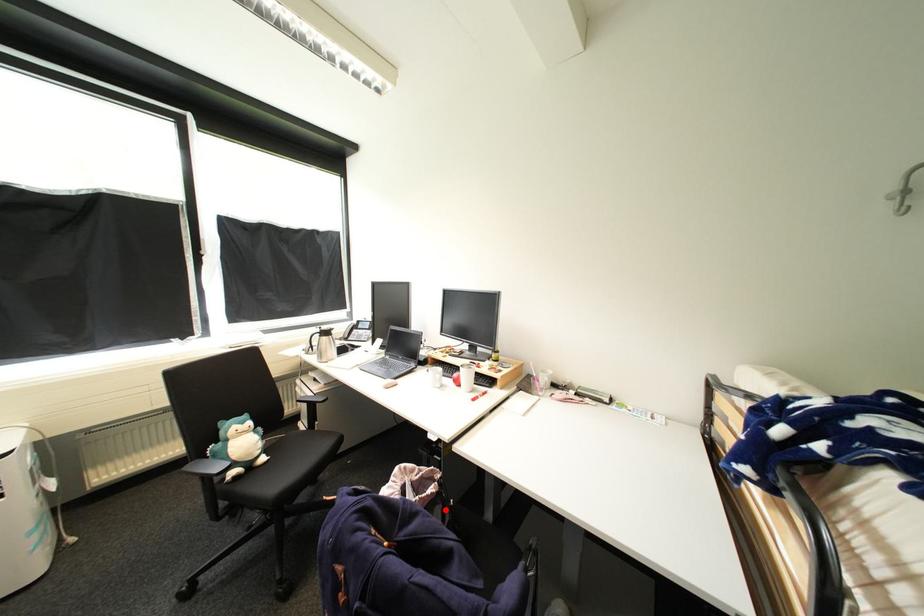
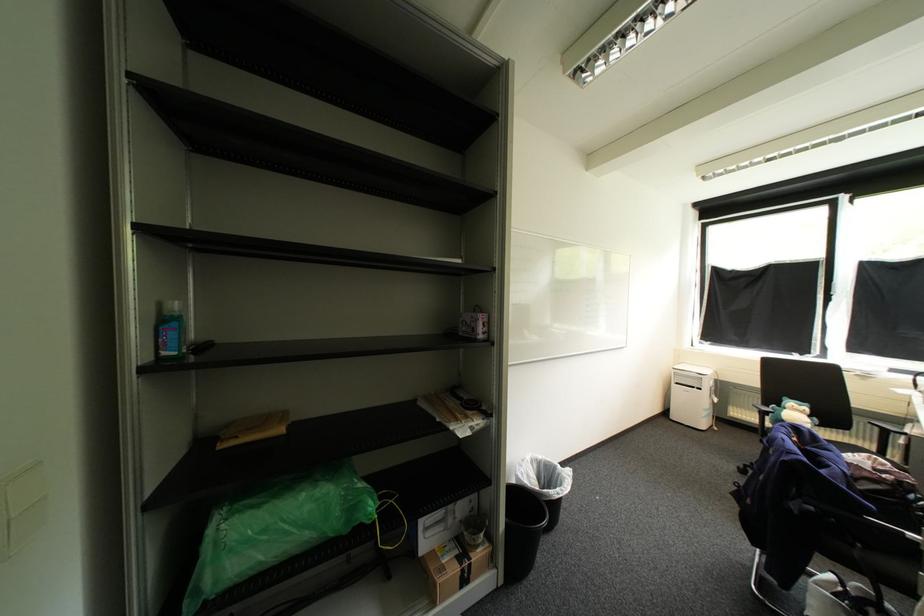
In the second image, find the point that corresponds to the highlighted location in the first image.

(885, 488)